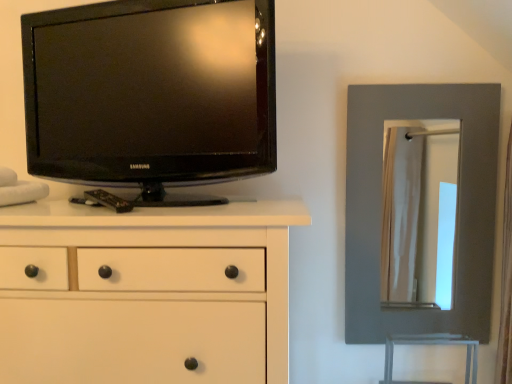
Question: Considering the relative positions of white matte chest of drawers at left and black glossy tv at upper left in the image provided, is white matte chest of drawers at left to the right of black glossy tv at upper left from the viewer's perspective?

Choices:
 (A) no
 (B) yes

Answer: (A)

Question: Could you tell me if white matte chest of drawers at left is facing black glossy tv at upper left?

Choices:
 (A) yes
 (B) no

Answer: (B)

Question: From a real-world perspective, is white matte chest of drawers at left over black glossy tv at upper left?

Choices:
 (A) no
 (B) yes

Answer: (A)

Question: Is white matte chest of drawers at left behind black glossy tv at upper left?

Choices:
 (A) yes
 (B) no

Answer: (B)

Question: Is white matte chest of drawers at left wider than black glossy tv at upper left?

Choices:
 (A) yes
 (B) no

Answer: (A)

Question: Can you confirm if white matte chest of drawers at left is positioned to the left of black glossy tv at upper left?

Choices:
 (A) yes
 (B) no

Answer: (A)

Question: Can you see matte gray mirror at right touching white matte chest of drawers at left?

Choices:
 (A) yes
 (B) no

Answer: (B)

Question: Is matte gray mirror at right to the left of white matte chest of drawers at left from the viewer's perspective?

Choices:
 (A) no
 (B) yes

Answer: (A)

Question: Does matte gray mirror at right come behind white matte chest of drawers at left?

Choices:
 (A) yes
 (B) no

Answer: (A)

Question: Is matte gray mirror at right located outside white matte chest of drawers at left?

Choices:
 (A) no
 (B) yes

Answer: (B)

Question: Does matte gray mirror at right have a greater height compared to white matte chest of drawers at left?

Choices:
 (A) no
 (B) yes

Answer: (B)

Question: Is matte gray mirror at right wider than white matte chest of drawers at left?

Choices:
 (A) yes
 (B) no

Answer: (B)

Question: Would you say matte gray mirror at right is a long distance from black glossy tv at upper left?

Choices:
 (A) no
 (B) yes

Answer: (A)